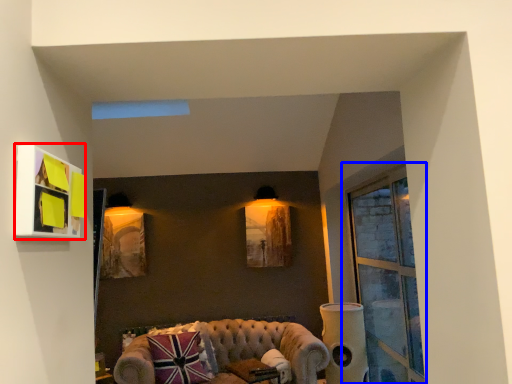
Question: Among these objects, which one is nearest to the camera, picture frame (highlighted by a red box) or window (highlighted by a blue box)?

Choices:
 (A) picture frame
 (B) window

Answer: (A)